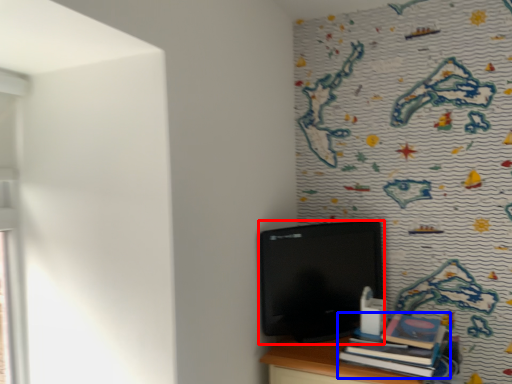
Question: Among these objects, which one is farthest to the camera, computer (highlighted by a red box) or book (highlighted by a blue box)?

Choices:
 (A) computer
 (B) book

Answer: (A)